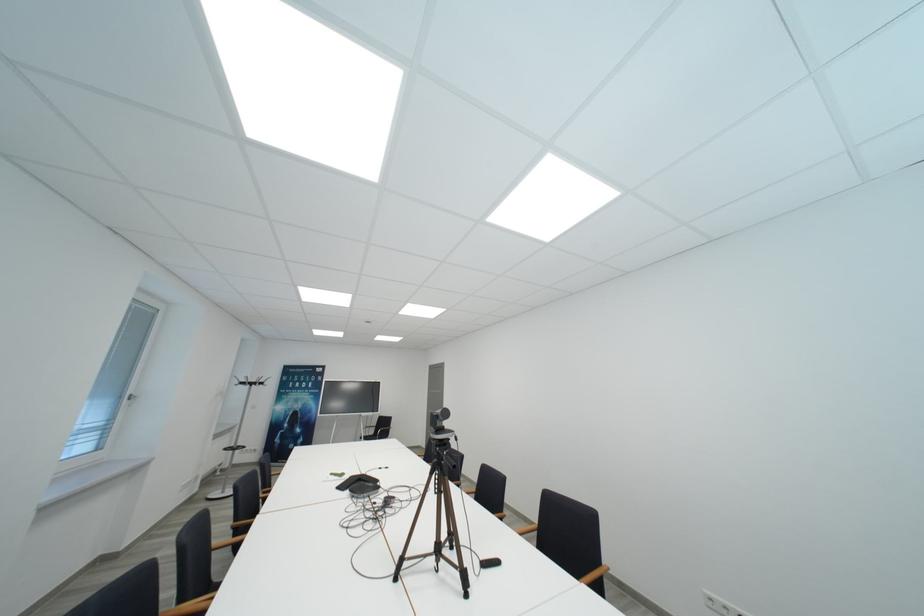
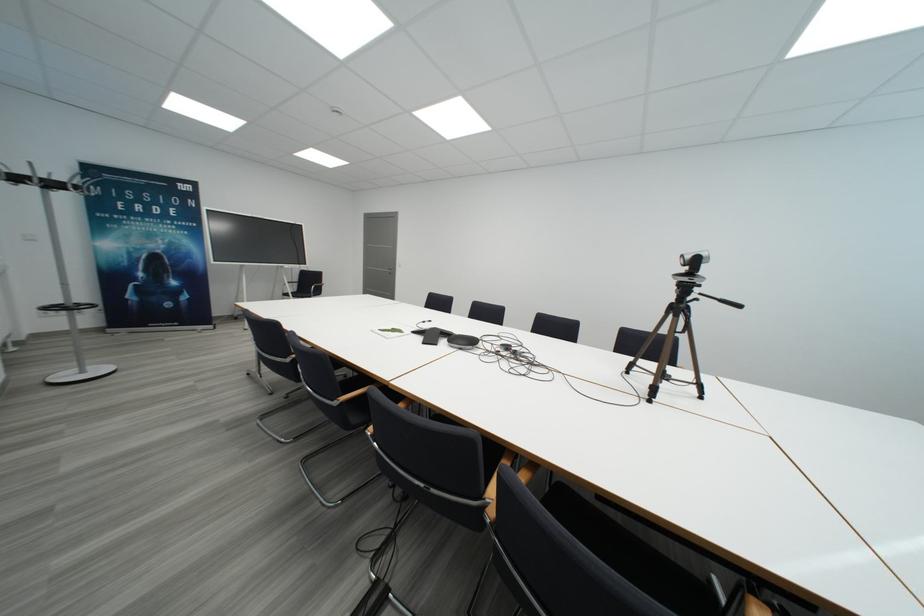
Find the pixel in the second image that matches (250,386) in the first image.

(21, 180)